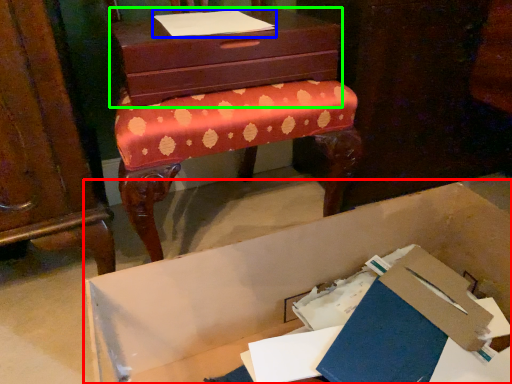
Question: Which is farther away from cardboard box (highlighted by a red box)? notebook (highlighted by a blue box) or chest of drawers (highlighted by a green box)?

Choices:
 (A) notebook
 (B) chest of drawers

Answer: (A)